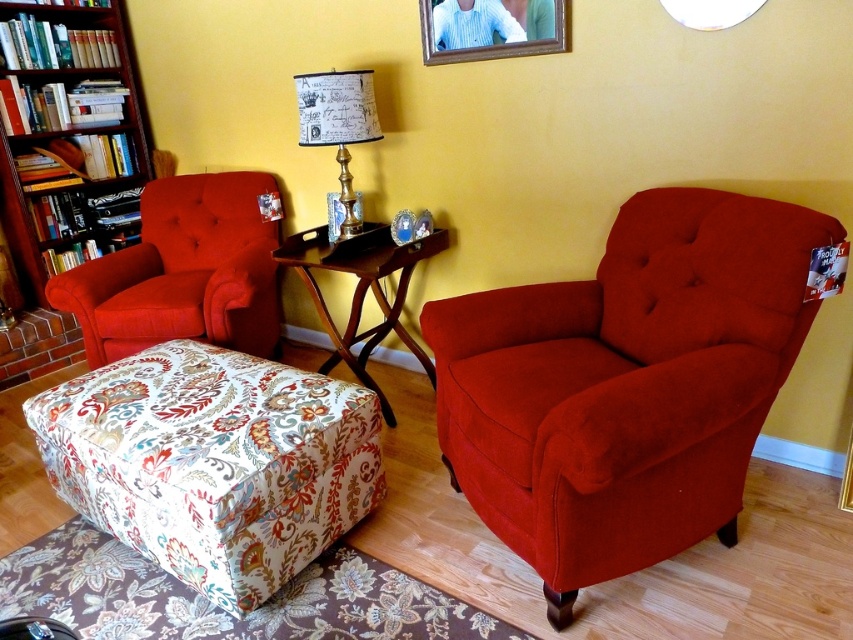
Question: Which of these objects is positioned farthest from the wooden bookshelf at left?

Choices:
 (A) wooden tray table at center
 (B) suede-like red armchair at right

Answer: (B)

Question: Which of the following is the farthest from the observer?

Choices:
 (A) (248, 608)
 (B) (496, 8)
 (C) (0, 140)

Answer: (C)

Question: Can you confirm if wooden bookshelf at left is smaller than wooden picture frame at upper center?

Choices:
 (A) yes
 (B) no

Answer: (B)

Question: Can you confirm if wooden bookshelf at left is bigger than gold metallic lampshade at upper center?

Choices:
 (A) yes
 (B) no

Answer: (A)

Question: Can you confirm if wooden picture frame at upper center is bigger than gold metallic lampshade at upper center?

Choices:
 (A) no
 (B) yes

Answer: (A)

Question: Which point is farther to the camera?

Choices:
 (A) wooden bookshelf at left
 (B) floral fabric ottoman at lower left
 (C) gold metallic lampshade at upper center

Answer: (A)